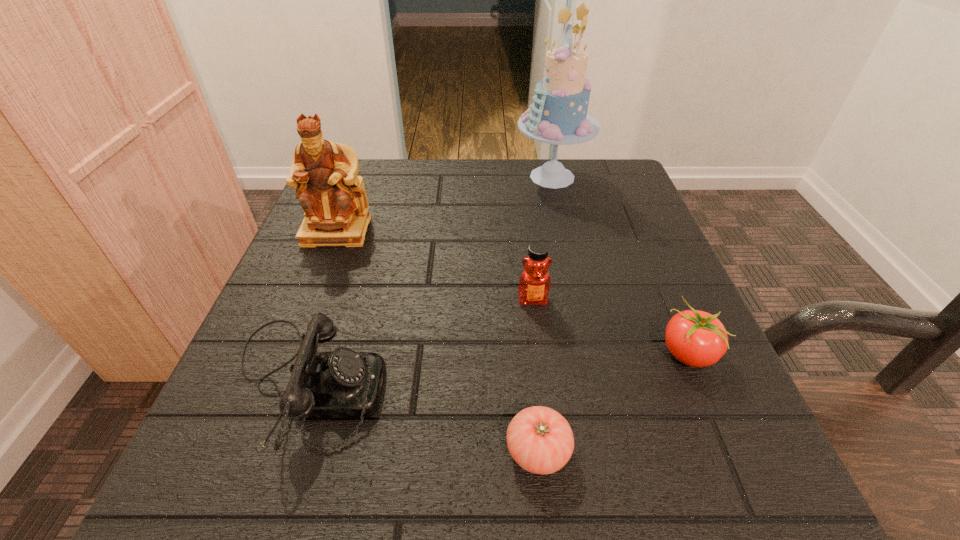
Image resolution: width=960 pixels, height=540 pixels. I want to click on telephone present at the near edge, so click(343, 383).

This screenshot has height=540, width=960. Find the location of `tomato present at the near edge`. tomato present at the near edge is located at coordinates (540, 440).

Where is `figurine that is at the left edge`? figurine that is at the left edge is located at coordinates (324, 173).

The height and width of the screenshot is (540, 960). In order to click on telephone situated at the left edge in this screenshot , I will do `click(343, 383)`.

Locate an element on the screen. The image size is (960, 540). cake at the right edge is located at coordinates (558, 115).

The width and height of the screenshot is (960, 540). In order to click on tomato located at the right edge in this screenshot , I will do point(696,338).

Identify the location of object at the near left corner. This screenshot has width=960, height=540. (343, 383).

You are a GUI agent. You are given a task and a screenshot of the screen. Output one action in this format:
    pyautogui.click(x=<x>, y=<y>)
    Task: Click on the object present at the far right corner
    
    Given the screenshot: What is the action you would take?
    pyautogui.click(x=558, y=115)

The height and width of the screenshot is (540, 960). I want to click on free space at the far edge of the desktop, so pyautogui.click(x=424, y=178).

This screenshot has height=540, width=960. In the image, there is a desktop. Find the location of `vacant space at the near edge`. vacant space at the near edge is located at coordinates coord(466,442).